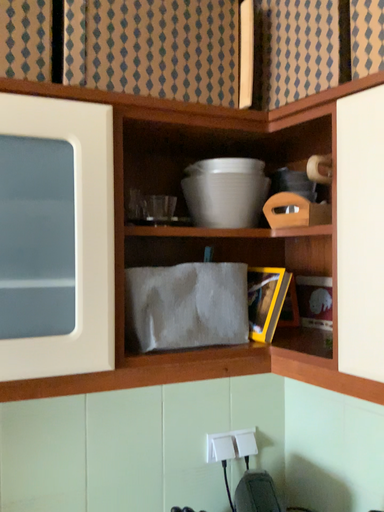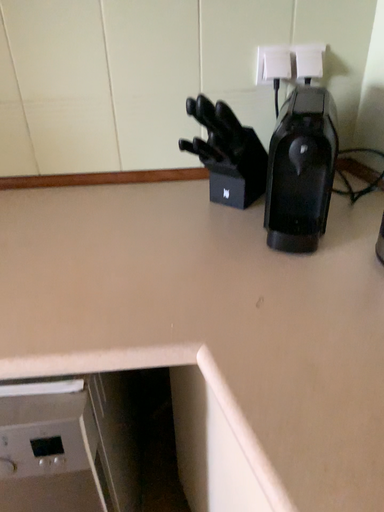
Question: Which way did the camera rotate in the video?

Choices:
 (A) rotated upward
 (B) rotated downward

Answer: (B)